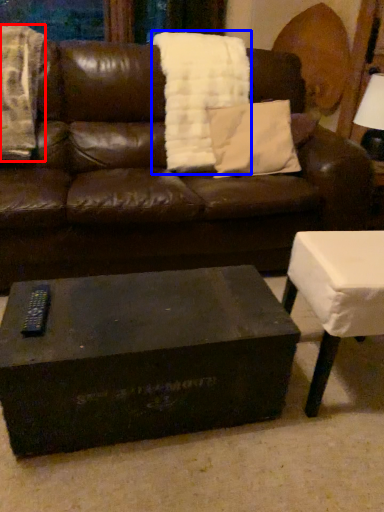
Question: Which object is further to the camera taking this photo, blanket (highlighted by a red box) or blanket (highlighted by a blue box)?

Choices:
 (A) blanket
 (B) blanket

Answer: (B)